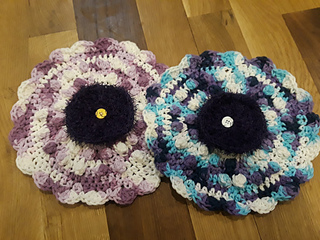
Identify the location of purple fabric. This screenshot has width=320, height=240. (51, 148).